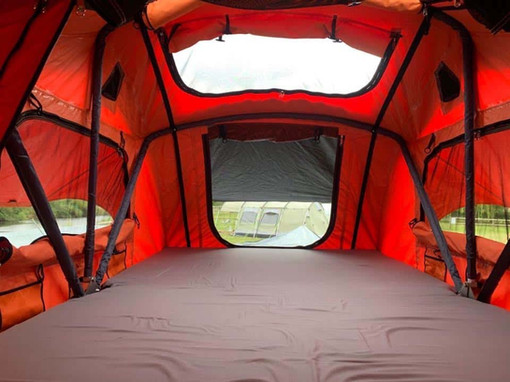
Where is `skylight`? skylight is located at coordinates (285, 61).